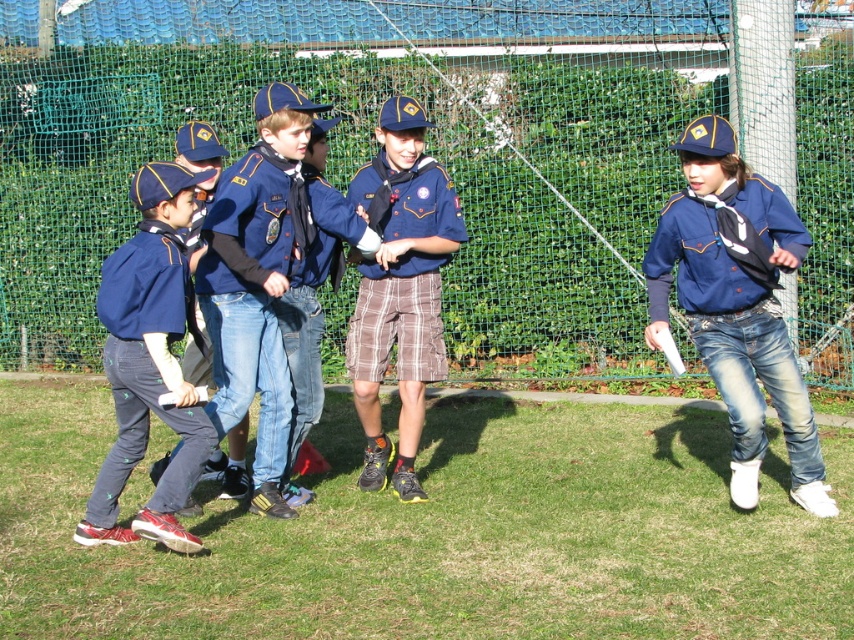
You are standing at the center of the field and see two points marked on the ground. One is at point (781, 403) and the other is at point (112, 525). If you want to move towards the point that is behind the other, which coordinate should you head towards?

You should head towards point (781, 403) because it is behind point (112, 525) according to the coordinates provided.

You are a photographer positioned at the origin of the coordinate system. You need to capture a photo of the matte blue shirt at center. Given that your camera has a focal length of 50mm and you want to ensure the subject fills the frame properly, what is the minimum distance you should maintain from the point marked at coordinate point (736, 304)?

The point (736, 304) marks the location of the matte blue shirt at center. To calculate the minimum distance, use the formula for camera framing where distance equals focal length multiplied by subject size divided by desired image size. However, without specific subject size or desired image dimensions, an exact distance cannot be determined. Ensure the camera is positioned close enough to capture the matte blue shirt at center clearly while maintaining focus.